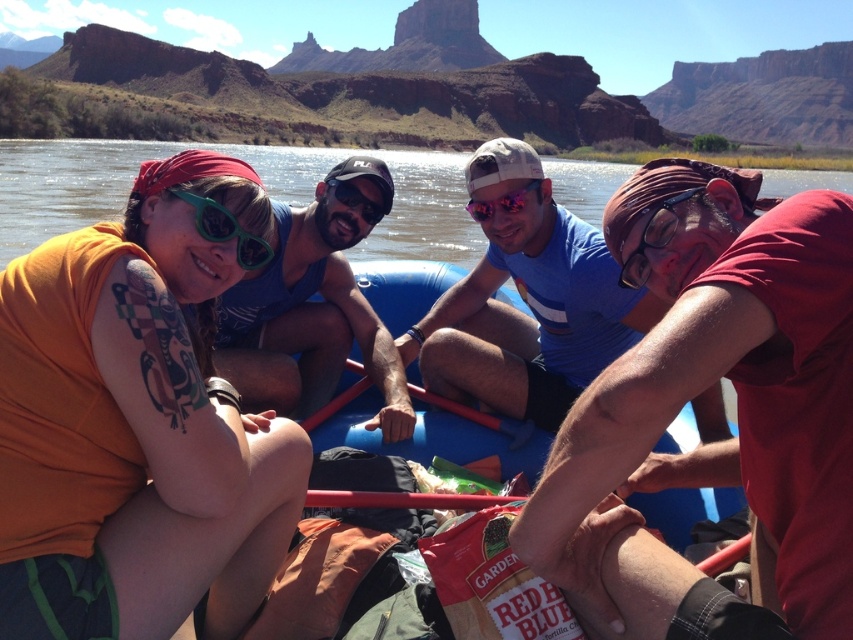
Question: Can you confirm if clear blue water at upper left is bigger than green plastic goggles at upper left?

Choices:
 (A) yes
 (B) no

Answer: (A)

Question: Does matte black tank top at left have a lesser width compared to matte black goggles at center?

Choices:
 (A) yes
 (B) no

Answer: (B)

Question: Observing the image, what is the correct spatial positioning of orange fabric at center in reference to matte black tank top at left?

Choices:
 (A) below
 (B) above

Answer: (A)

Question: Which is nearer to the pink reflective goggles at center?

Choices:
 (A) matte black goggles at center
 (B) orange fabric at center
 (C) matte black tank top at left

Answer: (A)

Question: Estimate the real-world distances between objects in this image. Which object is closer to the matte black tank top at left?

Choices:
 (A) transparent plastic goggles at center
 (B) orange fabric at center
 (C) clear blue water at upper left
 (D) blue cotton shirt at center

Answer: (D)

Question: Which of the following is the farthest from the observer?

Choices:
 (A) [512, 406]
 (B) [519, 205]
 (C) [660, 204]
 (D) [372, 224]

Answer: (D)